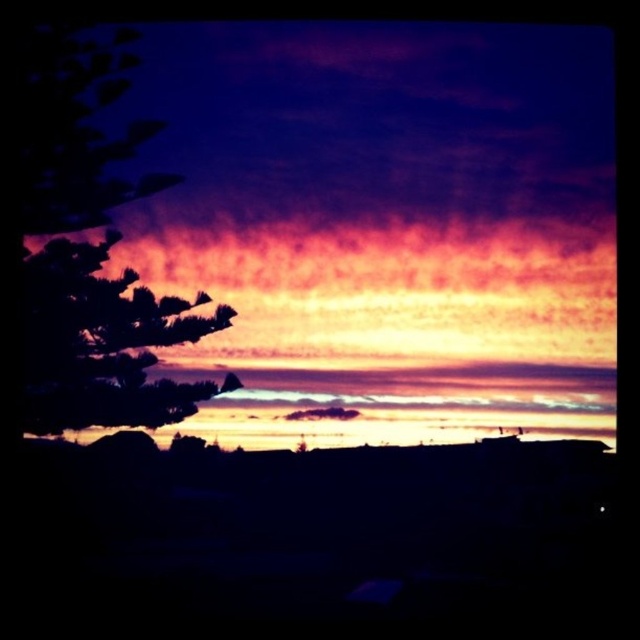
Can you confirm if purple matte cloud at upper center is positioned to the right of dark purple leafy tree at left?

Yes, purple matte cloud at upper center is to the right of dark purple leafy tree at left.

The height and width of the screenshot is (640, 640). Find the location of `purple matte cloud at upper center`. purple matte cloud at upper center is located at coordinates (384, 224).

Locate an element on the screen. This screenshot has height=640, width=640. purple matte cloud at upper center is located at coordinates (384, 224).

Which of these two, dark purple leafy tree at left or silhouette leafy tree at left, stands shorter?

silhouette leafy tree at left is shorter.

Does dark purple leafy tree at left have a lesser width compared to silhouette leafy tree at left?

Indeed, dark purple leafy tree at left has a lesser width compared to silhouette leafy tree at left.

Where is `dark purple leafy tree at left`? Image resolution: width=640 pixels, height=640 pixels. dark purple leafy tree at left is located at coordinates point(92,250).

Who is taller, purple matte cloud at upper center or silhouette leafy tree at left?

With more height is purple matte cloud at upper center.

Looking at this image, is purple matte cloud at upper center wider than silhouette leafy tree at left?

Correct, the width of purple matte cloud at upper center exceeds that of silhouette leafy tree at left.

What do you see at coordinates (384, 224) in the screenshot? The width and height of the screenshot is (640, 640). I see `purple matte cloud at upper center` at bounding box center [384, 224].

At what (x,y) coordinates should I click in order to perform the action: click on purple matte cloud at upper center. Please return your answer as a coordinate pair (x, y). The height and width of the screenshot is (640, 640). Looking at the image, I should click on (384, 224).